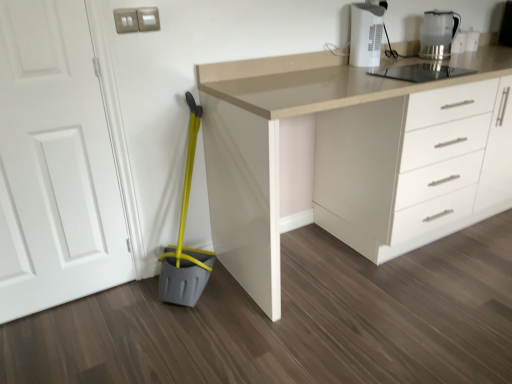
Question: Is beige laminate countertop at center turned away from translucent glass kettle at upper right?

Choices:
 (A) yes
 (B) no

Answer: (B)

Question: Can you confirm if beige laminate countertop at center is shorter than translucent glass kettle at upper right?

Choices:
 (A) yes
 (B) no

Answer: (B)

Question: Is beige laminate countertop at center far from translucent glass kettle at upper right?

Choices:
 (A) yes
 (B) no

Answer: (B)

Question: Is beige laminate countertop at center next to translucent glass kettle at upper right and touching it?

Choices:
 (A) yes
 (B) no

Answer: (B)

Question: From a real-world perspective, is beige laminate countertop at center below translucent glass kettle at upper right?

Choices:
 (A) yes
 (B) no

Answer: (A)

Question: Would you say white plastic coffee maker at upper right is inside or outside white matte door at left?

Choices:
 (A) inside
 (B) outside

Answer: (B)

Question: In terms of size, does white plastic coffee maker at upper right appear bigger or smaller than white matte door at left?

Choices:
 (A) big
 (B) small

Answer: (B)

Question: Considering the positions of point (354, 29) and point (53, 127), is point (354, 29) closer or farther from the camera than point (53, 127)?

Choices:
 (A) farther
 (B) closer

Answer: (A)

Question: Considering the positions of white plastic coffee maker at upper right and white matte door at left in the image, is white plastic coffee maker at upper right taller or shorter than white matte door at left?

Choices:
 (A) tall
 (B) short

Answer: (B)

Question: In terms of size, does white plastic coffee maker at upper right appear bigger or smaller than translucent glass kettle at upper right?

Choices:
 (A) big
 (B) small

Answer: (B)

Question: Which is correct: white plastic coffee maker at upper right is inside translucent glass kettle at upper right, or outside of it?

Choices:
 (A) inside
 (B) outside

Answer: (B)

Question: Is white plastic coffee maker at upper right wider or thinner than translucent glass kettle at upper right?

Choices:
 (A) wide
 (B) thin

Answer: (B)

Question: Considering the positions of white plastic coffee maker at upper right and translucent glass kettle at upper right in the image, is white plastic coffee maker at upper right taller or shorter than translucent glass kettle at upper right?

Choices:
 (A) tall
 (B) short

Answer: (A)

Question: Looking at their shapes, would you say white matte door at left is wider or thinner than translucent glass kettle at upper right?

Choices:
 (A) wide
 (B) thin

Answer: (B)

Question: Considering their positions, is white matte door at left located in front of or behind translucent glass kettle at upper right?

Choices:
 (A) behind
 (B) front

Answer: (B)